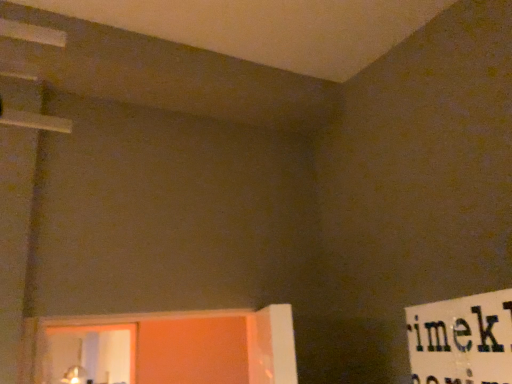
What do you see at coordinates (461, 340) in the screenshot? I see `white paper sign at lower right` at bounding box center [461, 340].

Locate an element on the screen. This screenshot has width=512, height=384. white paper sign at lower right is located at coordinates coord(461,340).

Where is `white paper sign at lower right`? white paper sign at lower right is located at coordinates (461, 340).